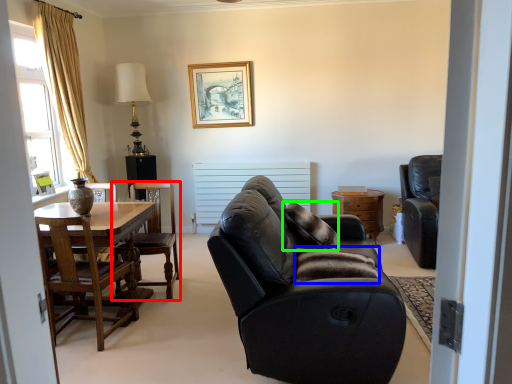
Question: Which is farther away from chair (highlighted by a red box)? pillow (highlighted by a blue box) or pillow (highlighted by a green box)?

Choices:
 (A) pillow
 (B) pillow

Answer: (A)